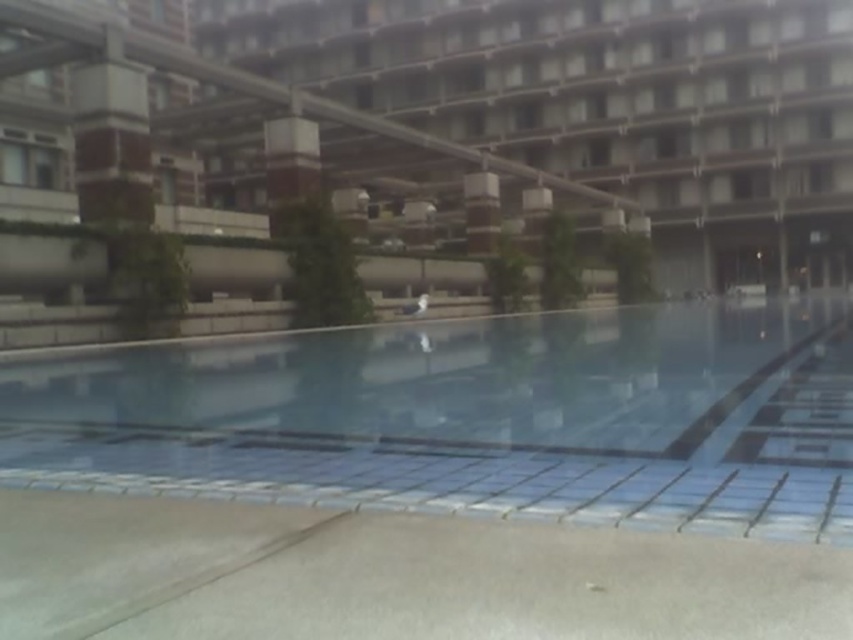
Is clear glass pool at center bigger than concrete building at center?

Incorrect, clear glass pool at center is not larger than concrete building at center.

Is point (306, 371) positioned behind point (753, 13)?

No, it is in front of (753, 13).

Does point (241, 364) lie in front of point (483, 234)?

Yes, it is in front of point (483, 234).

At what (x,y) coordinates should I click in order to perform the action: click on clear glass pool at center. Please return your answer as a coordinate pair (x, y). Looking at the image, I should click on (471, 419).